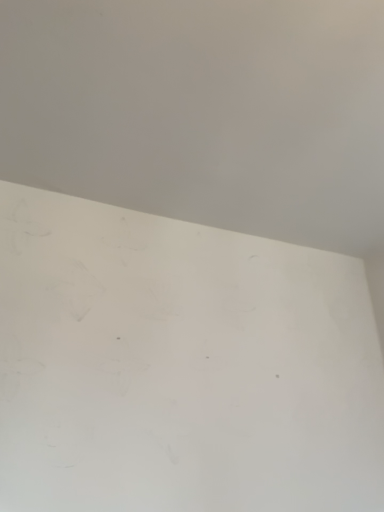
Find the location of a particular element. The height and width of the screenshot is (512, 384). white matte wall at upper center is located at coordinates (203, 111).

What do you see at coordinates (203, 111) in the screenshot? I see `white matte wall at upper center` at bounding box center [203, 111].

Locate an element on the screen. white matte wall at upper center is located at coordinates (203, 111).